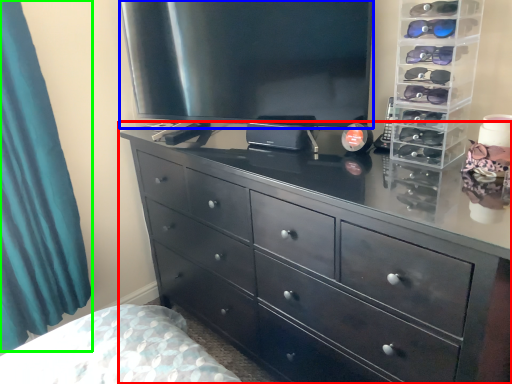
Question: Estimate the real-world distances between objects in this image. Which object is closer to chest of drawers (highlighted by a red box), television (highlighted by a blue box) or curtain (highlighted by a green box)?

Choices:
 (A) television
 (B) curtain

Answer: (A)